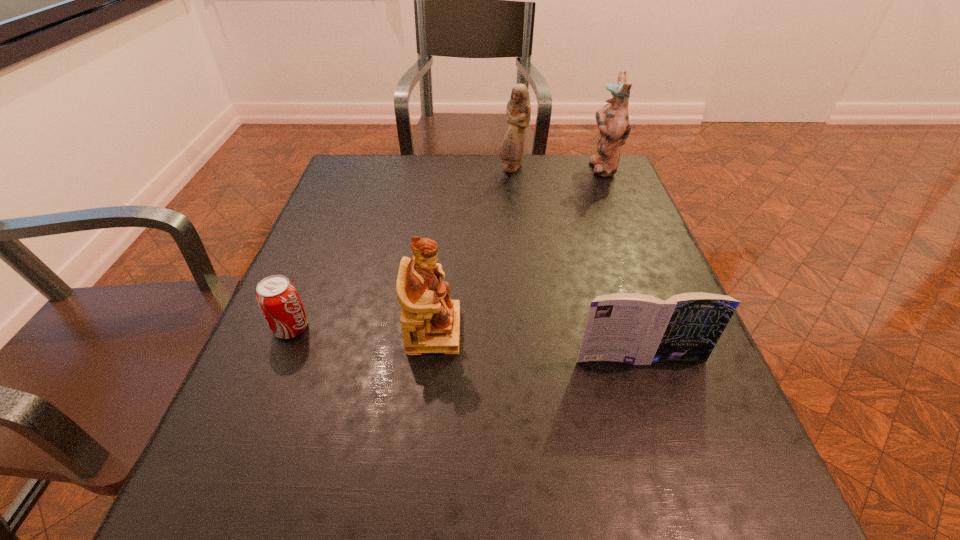
Locate an element on the screen. The height and width of the screenshot is (540, 960). free region that satisfies the following two spatial constraints: 1. on the front-facing side of the rightmost figurine; 2. on the front-facing side of the third object from right to left is located at coordinates (603, 168).

Locate an element on the screen. The height and width of the screenshot is (540, 960). vacant position in the image that satisfies the following two spatial constraints: 1. on the front-facing side of the rightmost figurine; 2. on the front-facing side of the second figurine from right to left is located at coordinates (603, 168).